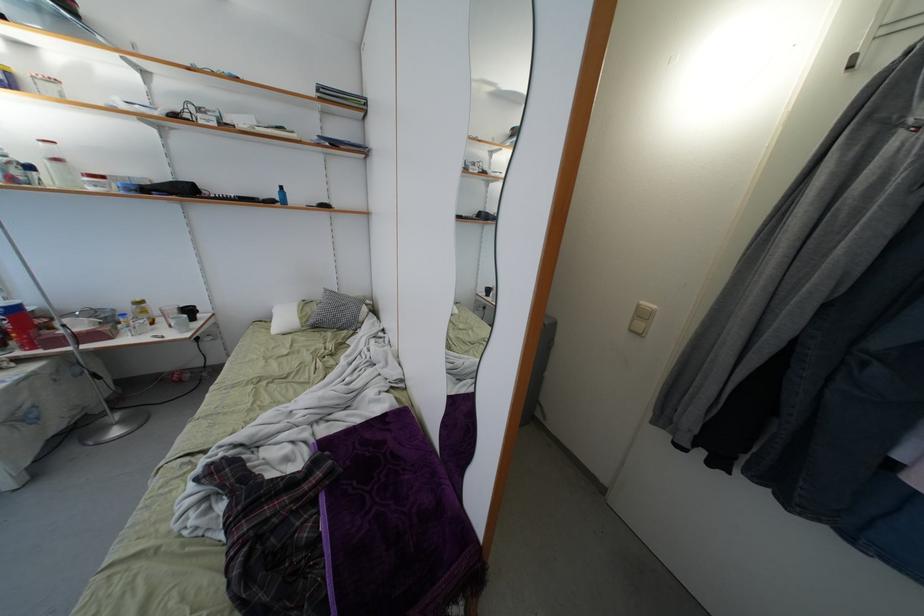
The height and width of the screenshot is (616, 924). Find the location of `red Coca-Cola can`. red Coca-Cola can is located at coordinates (19, 323).